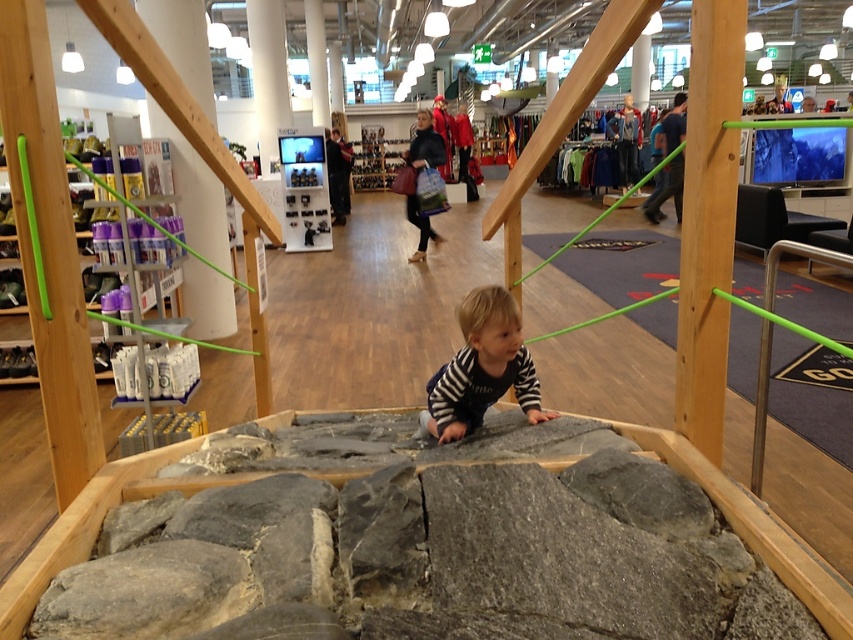
Question: Which point appears farthest from the camera in this image?

Choices:
 (A) (517, 372)
 (B) (724, 208)
 (C) (323, 173)

Answer: (C)

Question: Where is wooden pole at right located in relation to metallic silver toy at upper center in the image?

Choices:
 (A) above
 (B) below

Answer: (B)

Question: Is wooden pole at right closer to camera compared to striped cotton shirt at center?

Choices:
 (A) no
 (B) yes

Answer: (B)

Question: Estimate the real-world distances between objects in this image. Which object is closer to the wooden pole at right?

Choices:
 (A) metallic silver toy at upper center
 (B) striped cotton shirt at center

Answer: (B)

Question: Among these objects, which one is farthest from the camera?

Choices:
 (A) metallic silver toy at upper center
 (B) wooden pole at right

Answer: (A)

Question: Does striped cotton shirt at center have a greater width compared to metallic silver toy at upper center?

Choices:
 (A) yes
 (B) no

Answer: (B)